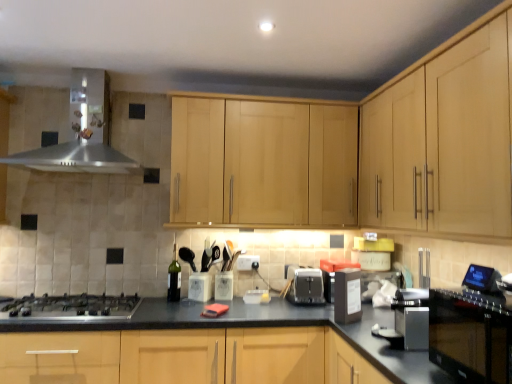
This screenshot has width=512, height=384. In order to click on free spot to the left of green glass bottle at center in this screenshot , I will do `click(146, 298)`.